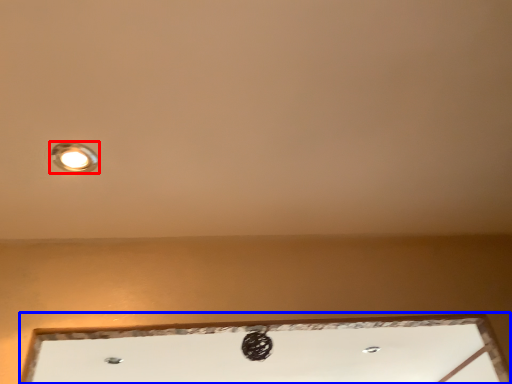
Question: Which object appears closest to the camera in this image, lamp (highlighted by a red box) or window (highlighted by a blue box)?

Choices:
 (A) lamp
 (B) window

Answer: (A)